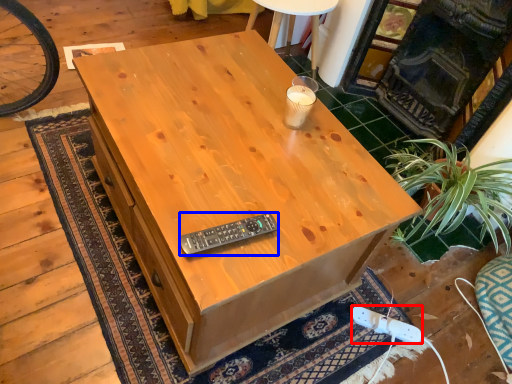
Question: Among these objects, which one is nearest to the camera, plug (highlighted by a red box) or control (highlighted by a blue box)?

Choices:
 (A) plug
 (B) control

Answer: (B)